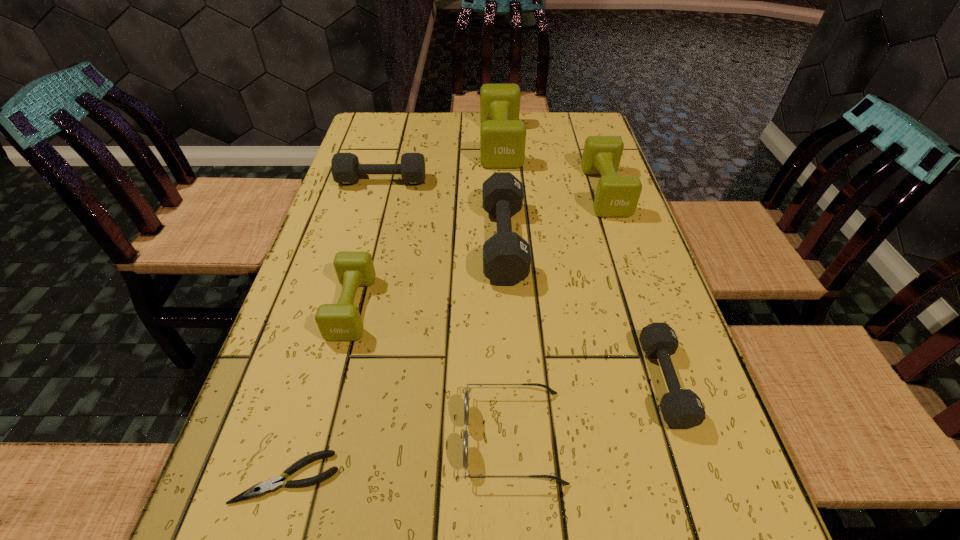
Identify which dumbbell is located as the third nearest to the second olive dumbbell from left to right. Please provide its 2D coordinates. Your answer should be formatted as a tuple, i.e. [(x, y)], where the tuple contains the x and y coordinates of a point satisfying the conditions above.

[(616, 195)]

Image resolution: width=960 pixels, height=540 pixels. What are the coordinates of `dumbbell that stands as the closest to the sunglasses` in the screenshot? It's located at (681, 408).

Find the location of a particular element. Image resolution: width=960 pixels, height=540 pixels. olive dumbbell that stands as the second closest to the shortest object is located at coordinates (616, 195).

Locate which olive dumbbell ranks in proximity to the leftmost olive dumbbell. Please provide its 2D coordinates. Your answer should be formatted as a tuple, i.e. [(x, y)], where the tuple contains the x and y coordinates of a point satisfying the conditions above.

[(502, 135)]

Locate an element on the screen. Image resolution: width=960 pixels, height=540 pixels. gray dumbbell that is the third closest to the tallest object is located at coordinates (681, 408).

Locate which gray dumbbell is the second closest to the shortest dumbbell. Please provide its 2D coordinates. Your answer should be formatted as a tuple, i.e. [(x, y)], where the tuple contains the x and y coordinates of a point satisfying the conditions above.

[(345, 167)]